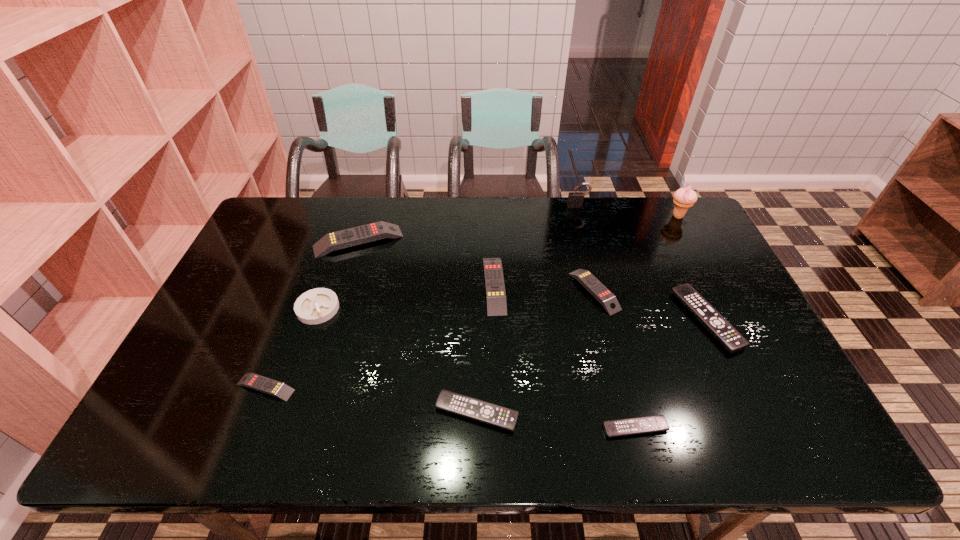
This screenshot has width=960, height=540. What are the coordinates of `the biggest black remote control` in the screenshot? It's located at (717, 325).

I want to click on the farthest black remote control, so click(x=717, y=325).

Identify the location of the nearest yellow remote control. (257, 382).

This screenshot has width=960, height=540. Identify the location of the leftmost black remote control. (475, 409).

Image resolution: width=960 pixels, height=540 pixels. In order to click on the shortest object in this screenshot , I will do `click(649, 424)`.

This screenshot has height=540, width=960. I want to click on the smallest black remote control, so click(649, 424).

At what (x,y) coordinates should I click in order to perform the action: click on vacant space located on the front of the tallest object. Please return your answer as a coordinate pair (x, y). Looking at the image, I should click on (721, 300).

This screenshot has width=960, height=540. In order to click on vacant area located with the keyhole on the front of the padlock in this screenshot , I will do `click(586, 234)`.

Identify the location of vacant area located on the right of the eighth shortest object. The width and height of the screenshot is (960, 540). (508, 241).

Where is `vacant space located 0.080m on the front of the gray ashtray`? This screenshot has height=540, width=960. vacant space located 0.080m on the front of the gray ashtray is located at coordinates (304, 348).